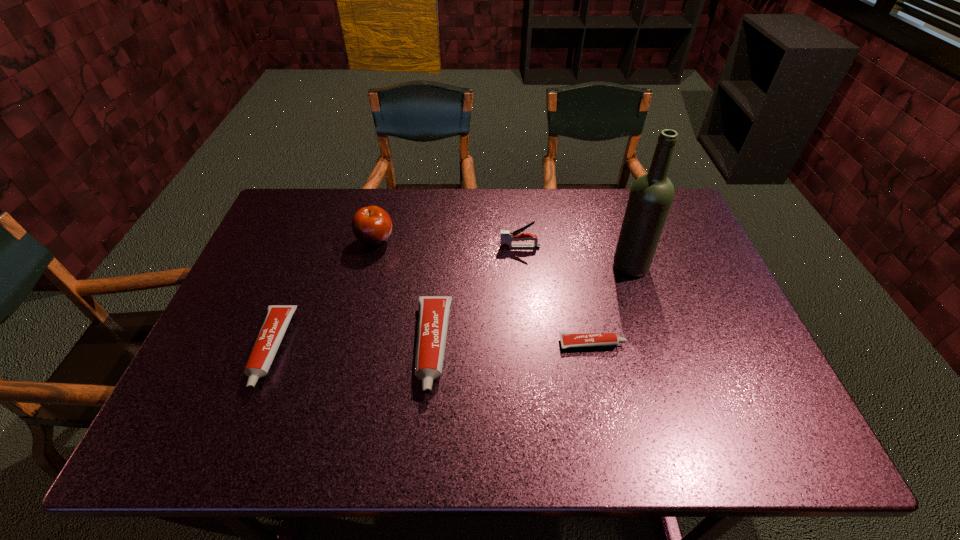
Please point a vacant point for placing a toothpaste on the right. Please provide its 2D coordinates. Your answer should be formatted as a tuple, i.e. [(x, y)], where the tuple contains the x and y coordinates of a point satisfying the conditions above.

[(750, 341)]